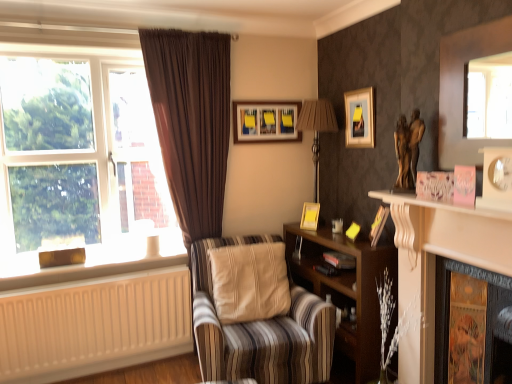
You are a GUI agent. You are given a task and a screenshot of the screen. Output one action in this format:
    pyautogui.click(x=<x>, y=<y>)
    Task: Click on the free spot in front of wooden picture frame at center, the third picture frame from the right
    The height and width of the screenshot is (384, 512).
    Given the screenshot: What is the action you would take?
    pyautogui.click(x=317, y=232)